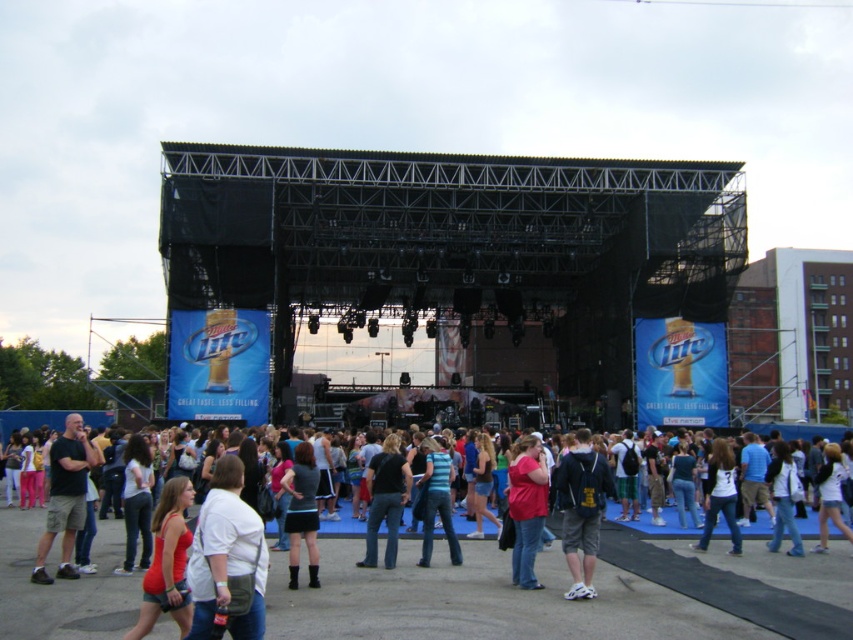
Question: Where is matte red tank top at center located in relation to striped cotton shirt at center in the image?

Choices:
 (A) right
 (B) left

Answer: (B)

Question: In this image, where is black skirt at center located relative to white matte shirt at center?

Choices:
 (A) above
 (B) below

Answer: (A)

Question: Which object appears closest to the camera in this image?

Choices:
 (A) black skirt at center
 (B) jeans at center
 (C) dark gray shorts at center

Answer: (C)

Question: Is dark gray backpack at center bigger than denim jacket at lower right?

Choices:
 (A) yes
 (B) no

Answer: (A)

Question: Considering the real-world distances, which object is farthest from the dark gray shorts at center?

Choices:
 (A) striped cotton shirt at center
 (B) denim jacket at center
 (C) white matte shirt at center
 (D) matte pink shirt at center

Answer: (C)

Question: Which point is farther from the camera taking this photo?

Choices:
 (A) (49, 460)
 (B) (560, 468)
 (C) (392, 532)
 (D) (778, 472)

Answer: (D)